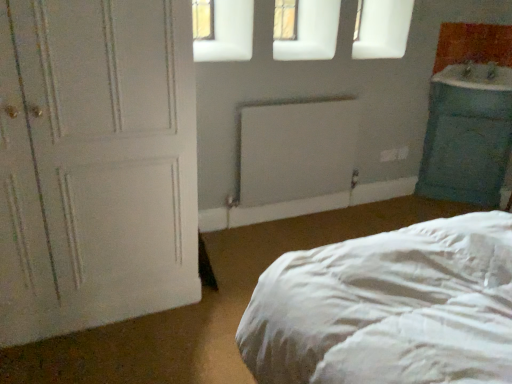
Question: In the image, is white matte door at left positioned in front of or behind white matte radiator at center?

Choices:
 (A) behind
 (B) front

Answer: (B)

Question: In terms of height, does white matte door at left look taller or shorter compared to white matte radiator at center?

Choices:
 (A) short
 (B) tall

Answer: (B)

Question: Which object is the farthest from the teal fabric pillow at right?

Choices:
 (A) blue glossy sink at right
 (B) white matte door at left
 (C) white matte radiator at center

Answer: (B)

Question: Considering the real-world distances, which object is closest to the white matte door at left?

Choices:
 (A) blue glossy sink at right
 (B) white matte radiator at center
 (C) teal fabric pillow at right

Answer: (B)